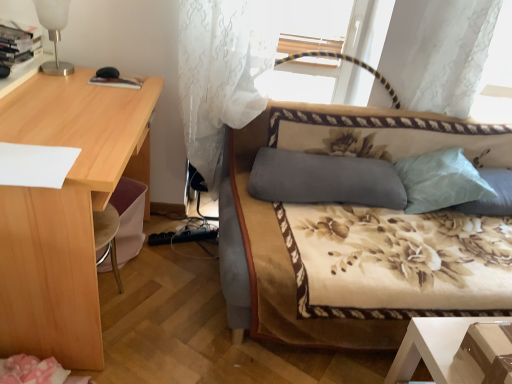
Locate an element on the screen. vacant area that is in front of white frosted glass table lamp at upper left is located at coordinates (51, 85).